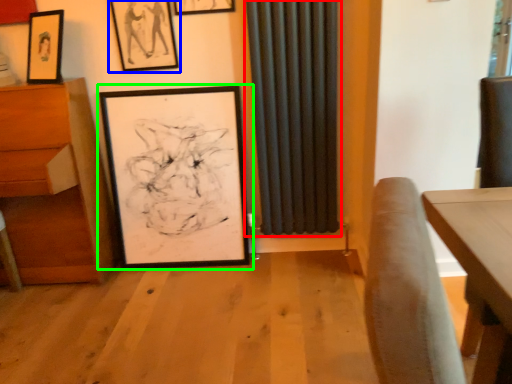
Question: Which object is the closest to the curtain (highlighted by a red box)? Choose among these: picture frame (highlighted by a blue box) or picture frame (highlighted by a green box).

Choices:
 (A) picture frame
 (B) picture frame

Answer: (B)